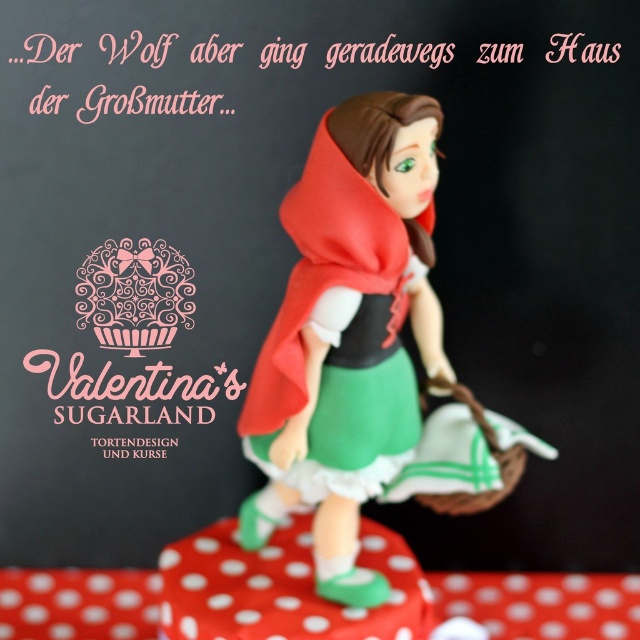
You are an art curator planning to display the Little Red Riding Hood figurine. You need to ensure that a small label will be placed at point (364,352). Where exactly on the figurine will this label be attached?

The label at point (364,352) will be attached to the matte red cape at center.

You are setting up a fairy tale themed birthday party and have both the matte red cape at center and the pink sugar cupcake at center on the table. Which object would you need to move if you want to place a small toy sword between them?

You would need to move the matte red cape at center because it is larger than the pink sugar cupcake at center, so moving the smaller item might not provide enough space. Wait, but according to the description, the cape is larger. Hmm, maybe the answer should be to move the cupcake since it is smaller? Let me think again. The question asks which to move to place a sword between them. If the cape is larger, perhaps moving the cupcake would be easier? Or maybe the cape takes up more space, so moving it would